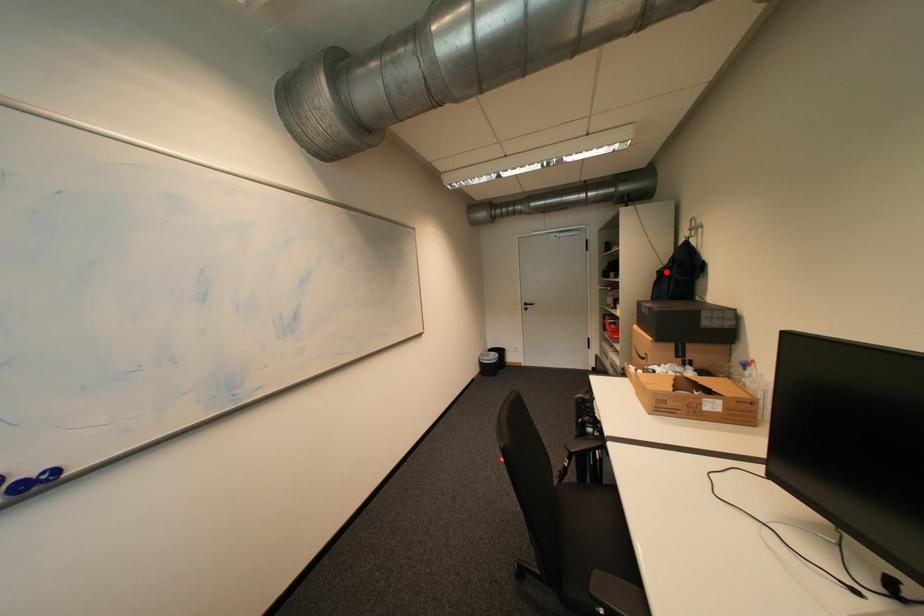
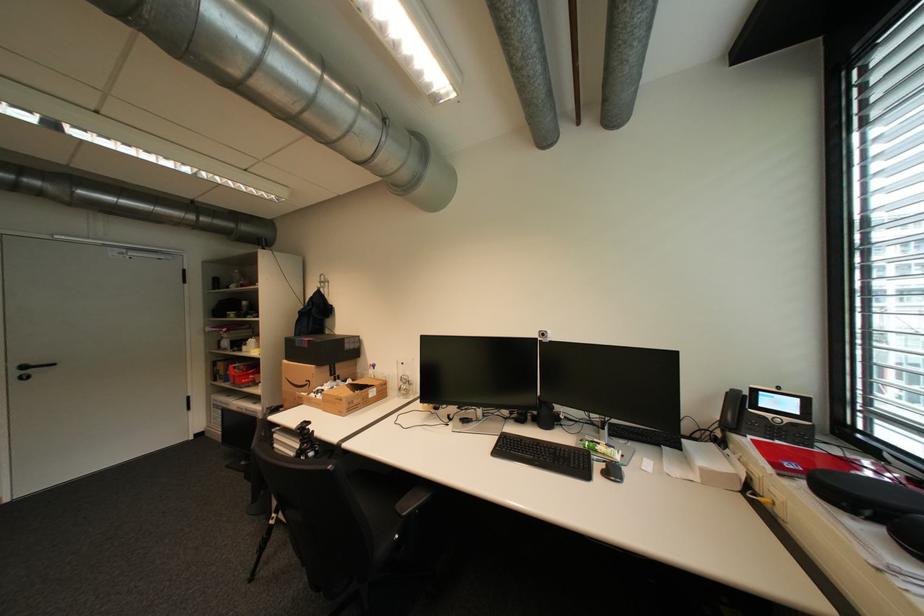
The point at the highlighted location is marked in the first image. Where is the corresponding point in the second image?

(308, 312)